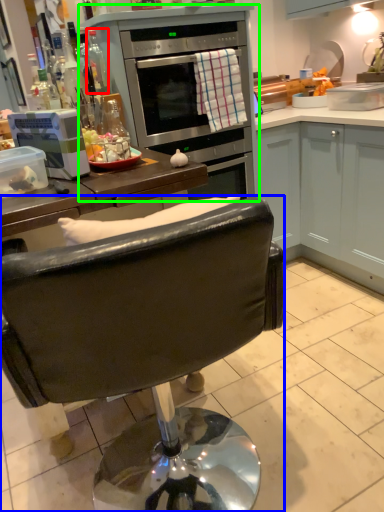
Question: Which object is the farthest from bottle (highlighted by a red box)? Choose among these: chair (highlighted by a blue box) or appliance (highlighted by a green box).

Choices:
 (A) chair
 (B) appliance

Answer: (A)